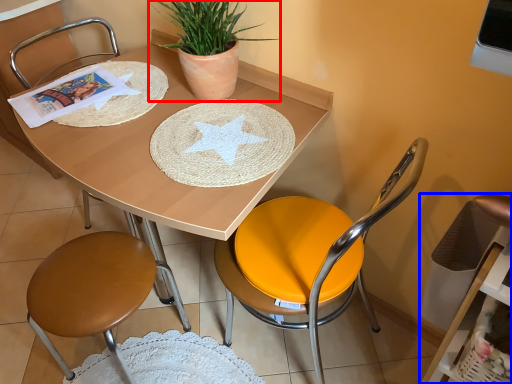
Question: Which of the following is the closest to the observer, houseplant (highlighted by a red box) or swivel chair (highlighted by a blue box)?

Choices:
 (A) houseplant
 (B) swivel chair

Answer: (B)